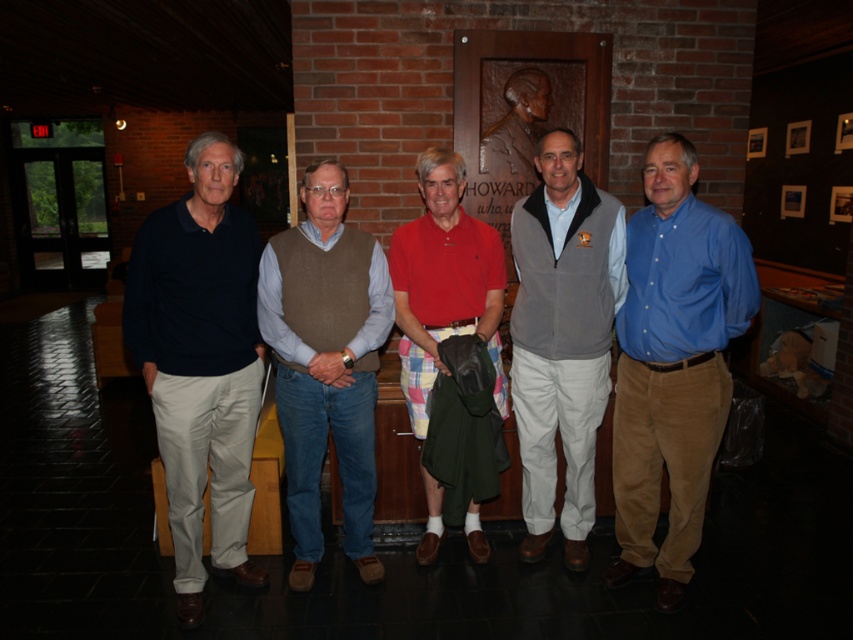
Question: Is blue corduroy pants at right to the right of brown wool vest at center from the viewer's perspective?

Choices:
 (A) no
 (B) yes

Answer: (B)

Question: Which of these objects is positioned farthest from the gray fleece vest at center?

Choices:
 (A) blue corduroy pants at right
 (B) matte bronze bust at center

Answer: (B)

Question: Which of the following is the closest to the observer?

Choices:
 (A) (546, 464)
 (B) (287, 326)
 (C) (693, 342)
 (D) (433, 349)

Answer: (C)

Question: Based on their relative distances, which object is farther from the matte bronze bust at center?

Choices:
 (A) gray fleece vest at center
 (B) dark blue cotton polo shirt at left

Answer: (B)

Question: From the image, what is the correct spatial relationship of brown wool vest at center in relation to matte bronze bust at center?

Choices:
 (A) below
 (B) above

Answer: (A)

Question: Can you confirm if dark blue cotton polo shirt at left is smaller than red cotton polo shirt at center?

Choices:
 (A) yes
 (B) no

Answer: (B)